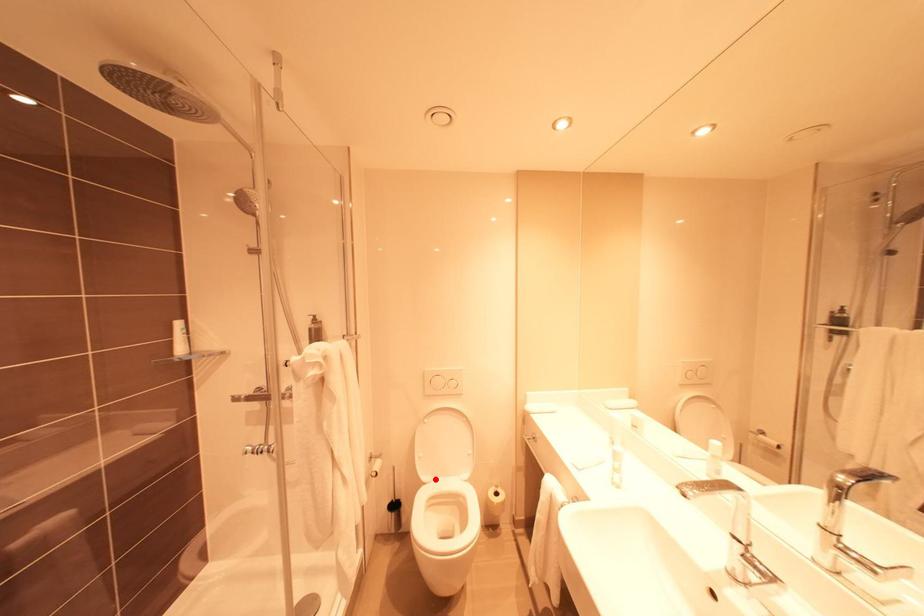
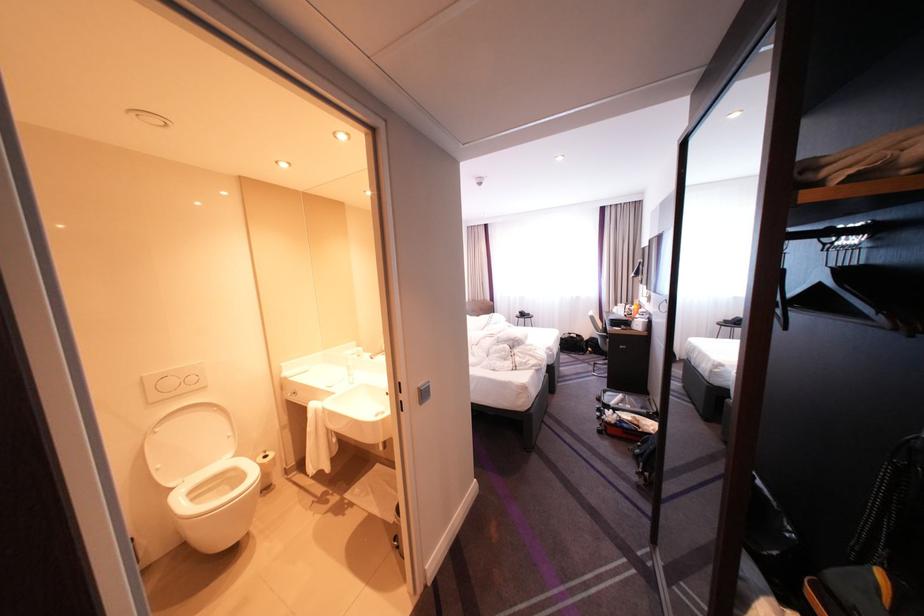
Question: I am providing you with two images of the same scene from different viewpoints. Given a red point in image1, look at the same physical point in image2. Is it:

Choices:
 (A) Closer to the viewpoint
 (B) Farther from the viewpoint

Answer: (A)